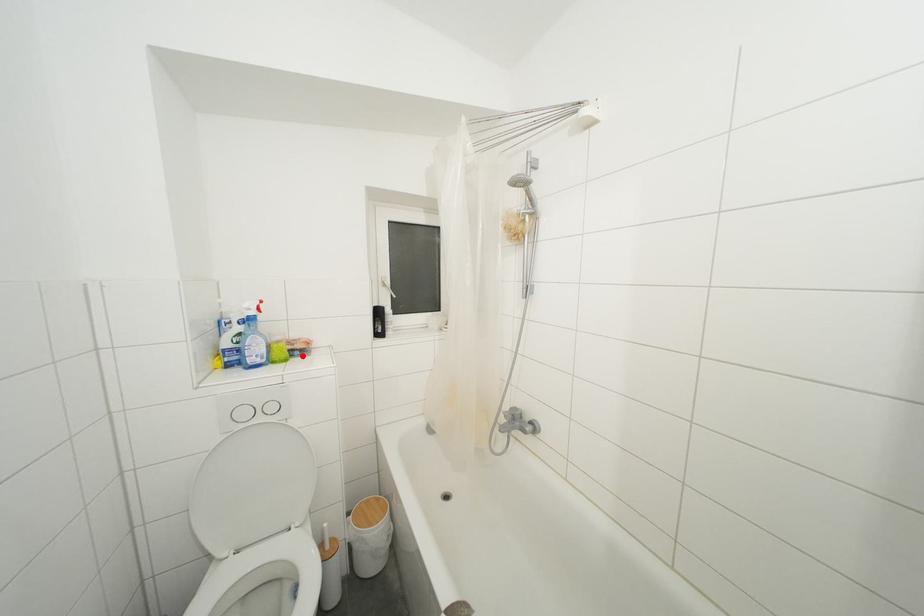
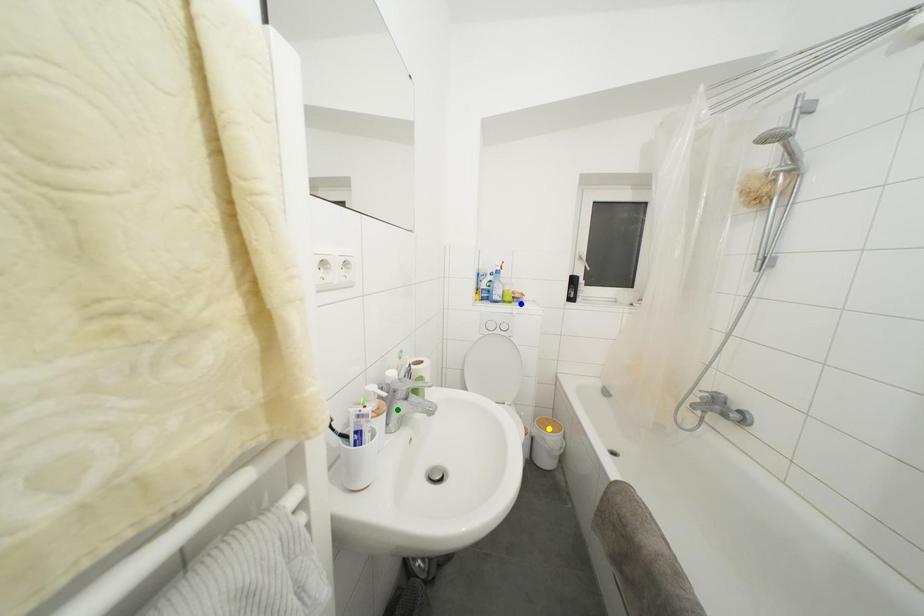
Question: I am providing you with two images of the same scene from different viewpoints. A red point is marked on the first image. You are given multiple points on the second image. Which spot in image 2 lines up with the point in image 1?

Choices:
 (A) yellow point
 (B) blue point
 (C) green point

Answer: (B)